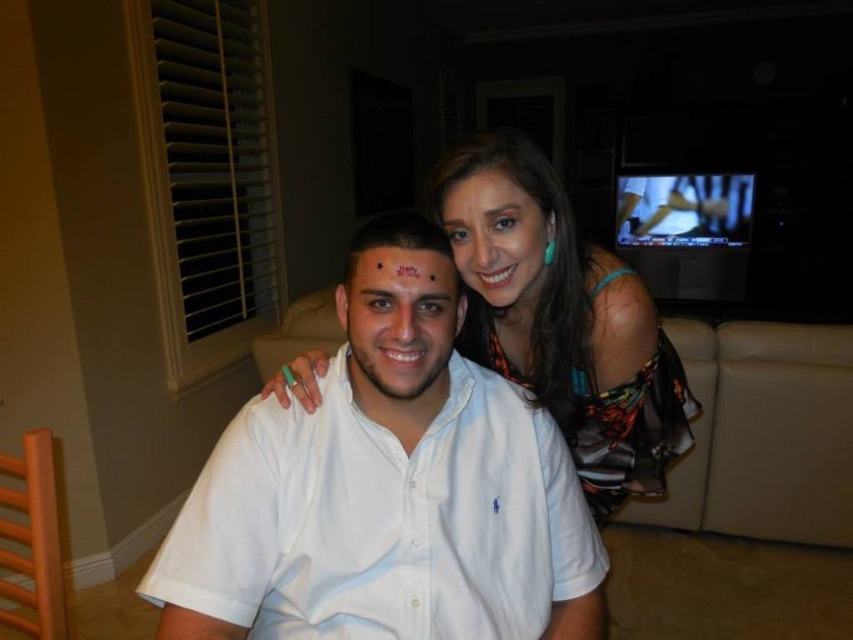
Looking at this image, you are a photographer setting up a camera in the living room scene. You need to ensure that the multicolored sheer dress at upper right and the matte black hair at upper center are both in focus. Since the dress is wider, will you need to adjust the camera settings to accommodate its size?

The multicolored sheer dress at upper right is wider than the matte black hair at upper center, so you should adjust the camera settings to ensure the dress is fully captured in focus.

Based on the scene description, can you determine the spatial relationship between the white cotton shirt at center and the multicolored sheer dress at upper right?

The white cotton shirt at center is to the left of the multicolored sheer dress at upper right.

You are a photographer setting up for a portrait. You need to ensure that both the white cotton shirt at center and the matte black forehead at center are in focus. The camera has a depth of field that can cover 10 inches. Can both subjects be in focus simultaneously?

The distance between the white cotton shirt at center and the matte black forehead at center is 9.93 inches, which is within the camera depth of field range of 10 inches. Therefore, both subjects can be in focus simultaneously.